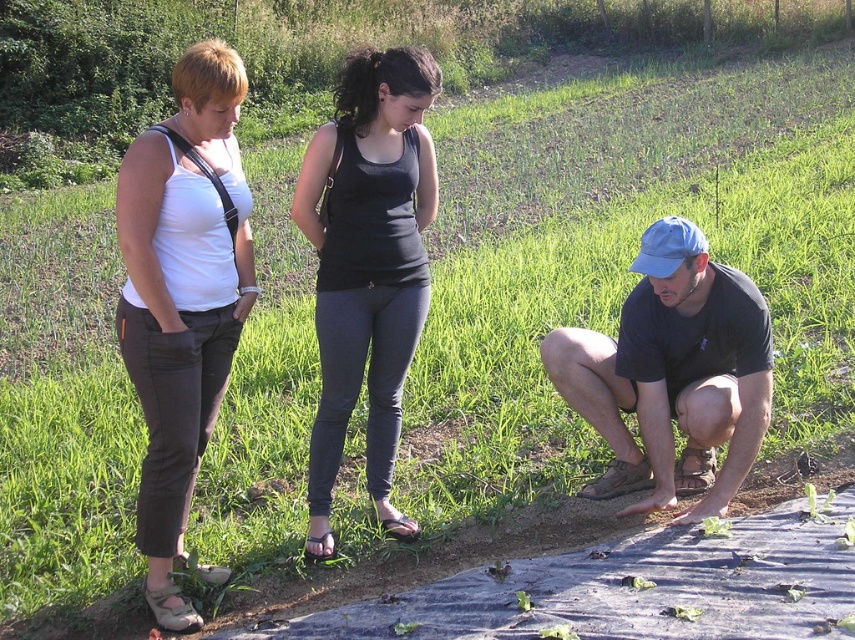
Question: Which of these objects is positioned farthest from the white matte tank top at left?

Choices:
 (A) blue cap at lower right
 (B) black matte tank top at center

Answer: (A)

Question: Estimate the real-world distances between objects in this image. Which object is closer to the black matte tank top at center?

Choices:
 (A) matte white tank top at center
 (B) white matte tank top at left

Answer: (A)

Question: Does matte white tank top at center have a larger size compared to white matte tank top at left?

Choices:
 (A) no
 (B) yes

Answer: (B)

Question: Does matte white tank top at center appear on the right side of black matte tank top at center?

Choices:
 (A) no
 (B) yes

Answer: (A)

Question: Which object is positioned closest to the matte white tank top at center?

Choices:
 (A) black matte tank top at center
 (B) white matte tank top at left
 (C) blue cap at lower right

Answer: (B)

Question: Is matte white tank top at center positioned before white matte tank top at left?

Choices:
 (A) no
 (B) yes

Answer: (B)